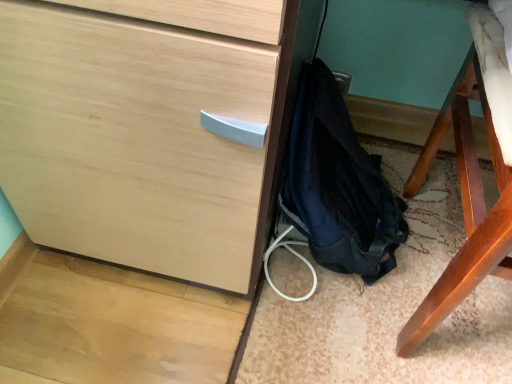
Locate an element on the screen. Image resolution: width=512 pixels, height=384 pixels. free space in front of dark blue fabric backpack at lower right is located at coordinates (303, 349).